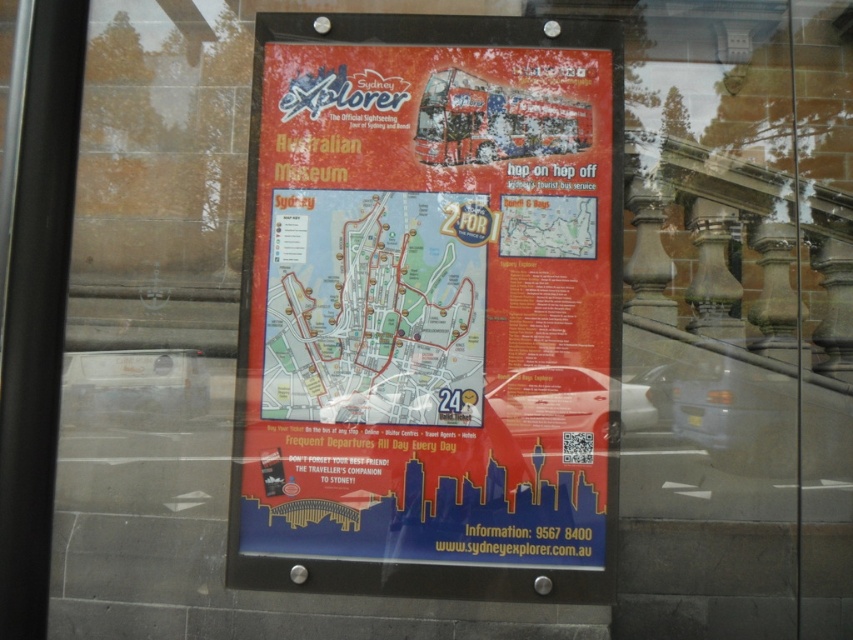
You are designing a display board and have both the red matte poster at center and the blue paper map at center. Which one is taller?

The red matte poster at center is taller than the blue paper map at center.